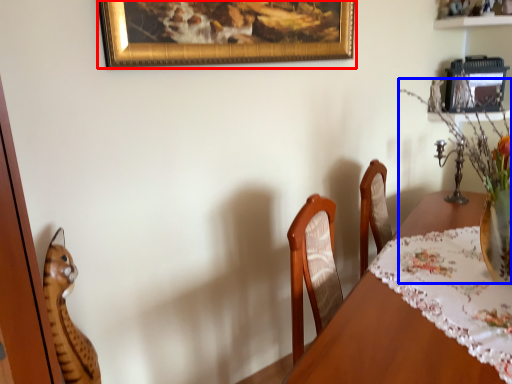
Question: Among these objects, which one is farthest to the camera, picture frame (highlighted by a red box) or floral arrangement (highlighted by a blue box)?

Choices:
 (A) picture frame
 (B) floral arrangement

Answer: (A)